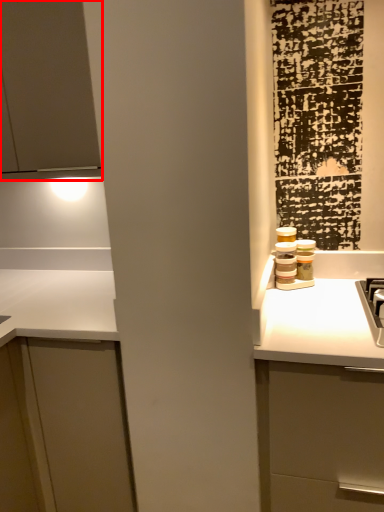
Question: From the image's perspective, what is the correct spatial positioning of cabinetry (annotated by the red box) in reference to cabinetry?

Choices:
 (A) below
 (B) above

Answer: (B)